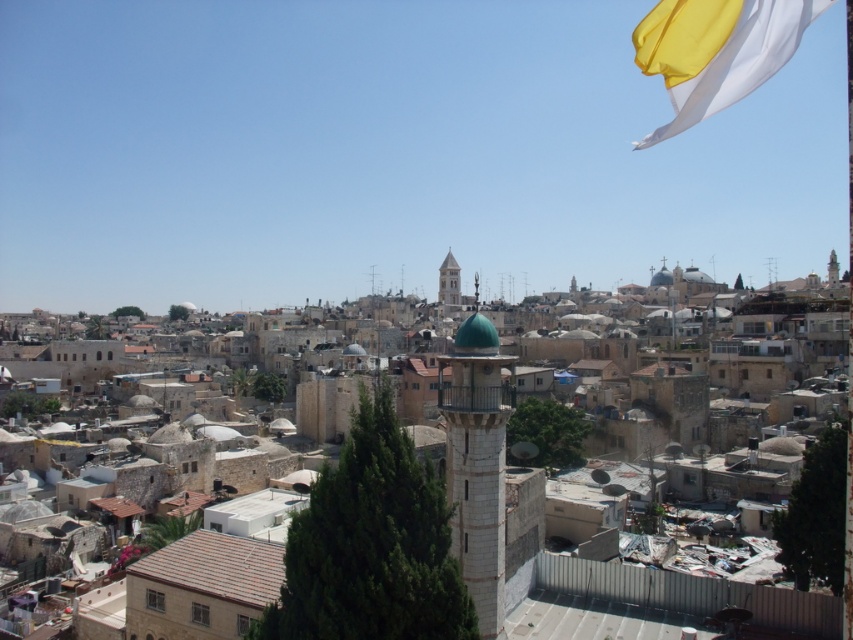
You are a tourist standing at the base of the white stone tower at center and want to take a photo of the white silky flag at upper right. Can you see the flag clearly from your current position?

The white stone tower at center is located below the white silky flag at upper right, so yes, you can see the white silky flag at upper right clearly from the base of the white stone tower at center since it is positioned above it.

You are a drone operator tasked with flying a drone between the stone minaret at center and the light beige stone tower at center in the urban area. The drone has a maximum flight distance of 250 meters. Can the drone safely complete the flight without needing to recharge?

The distance between the stone minaret at center and the light beige stone tower at center is 263.09 meters, which exceeds the drone maximum flight distance of 250 meters. Therefore, the drone cannot safely complete the flight without needing to recharge.